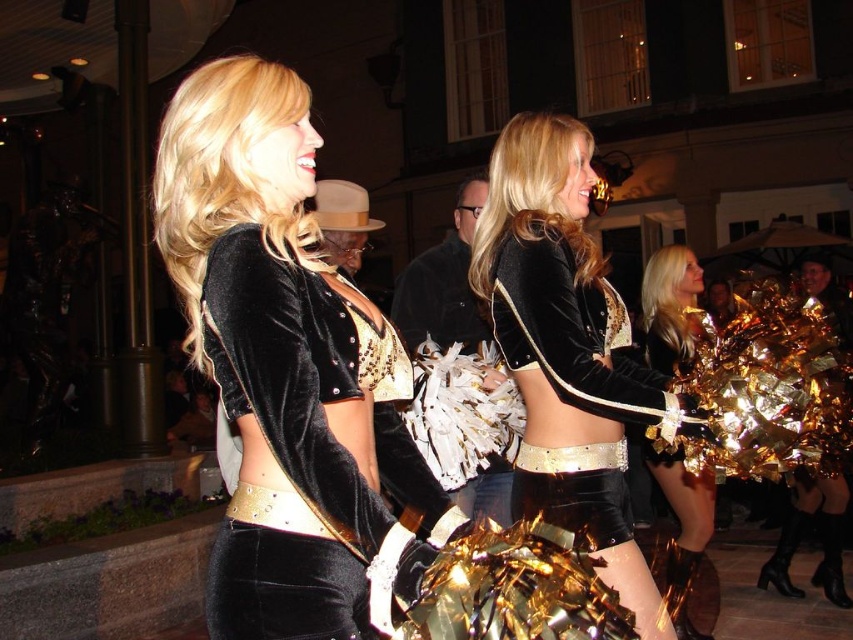
Question: Which is nearer to the shiny gold pom-poms at center?

Choices:
 (A) velvet/black dress at center
 (B) velvet/goldenmaterial/texture cheerleader at center

Answer: (A)

Question: Which point appears closest to the camera in this image?

Choices:
 (A) (225, 248)
 (B) (647, 582)

Answer: (A)

Question: Does velvet/black dress at center appear under shiny gold pom-poms at center?

Choices:
 (A) no
 (B) yes

Answer: (A)

Question: Which point appears farthest from the camera in this image?

Choices:
 (A) (677, 364)
 (B) (527, 236)
 (C) (384, 449)
 (D) (631, 372)

Answer: (A)

Question: Where is velvet/goldenmaterial/texture cheerleader at center located in relation to shiny gold pom-poms at center in the image?

Choices:
 (A) left
 (B) right

Answer: (A)

Question: Is velvet black jacket at center in front of shiny gold pom-poms at center?

Choices:
 (A) no
 (B) yes

Answer: (B)